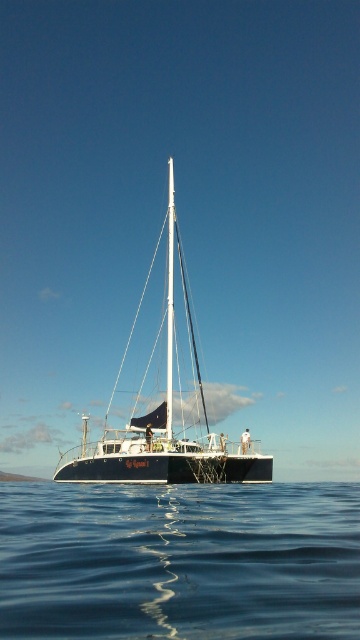
Question: Which of the following is the closest to the observer?

Choices:
 (A) [x=228, y=604]
 (B) [x=213, y=474]
 (C) [x=171, y=326]

Answer: (A)

Question: Among these objects, which one is nearest to the camera?

Choices:
 (A) white glossy mast at center
 (B) blue liquid water at lower center
 (C) white glossy sailboat at center

Answer: (B)

Question: Is blue liquid water at lower center thinner than white glossy mast at center?

Choices:
 (A) no
 (B) yes

Answer: (A)

Question: Which point is farther to the camera?

Choices:
 (A) blue liquid water at lower center
 (B) white glossy mast at center
 (C) white glossy sailboat at center

Answer: (B)

Question: Is the position of blue liquid water at lower center more distant than that of white glossy sailboat at center?

Choices:
 (A) yes
 (B) no

Answer: (B)

Question: Does blue liquid water at lower center come behind white glossy mast at center?

Choices:
 (A) no
 (B) yes

Answer: (A)